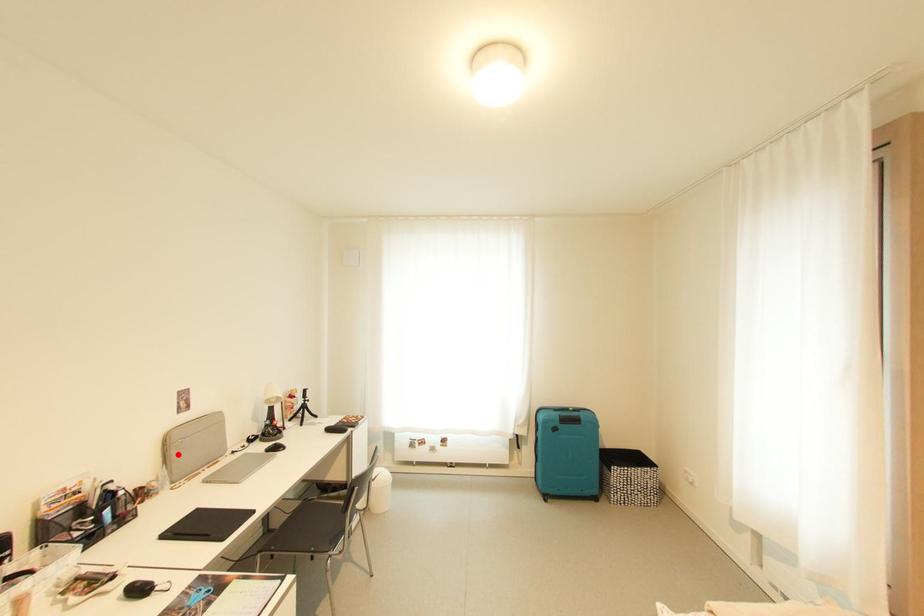
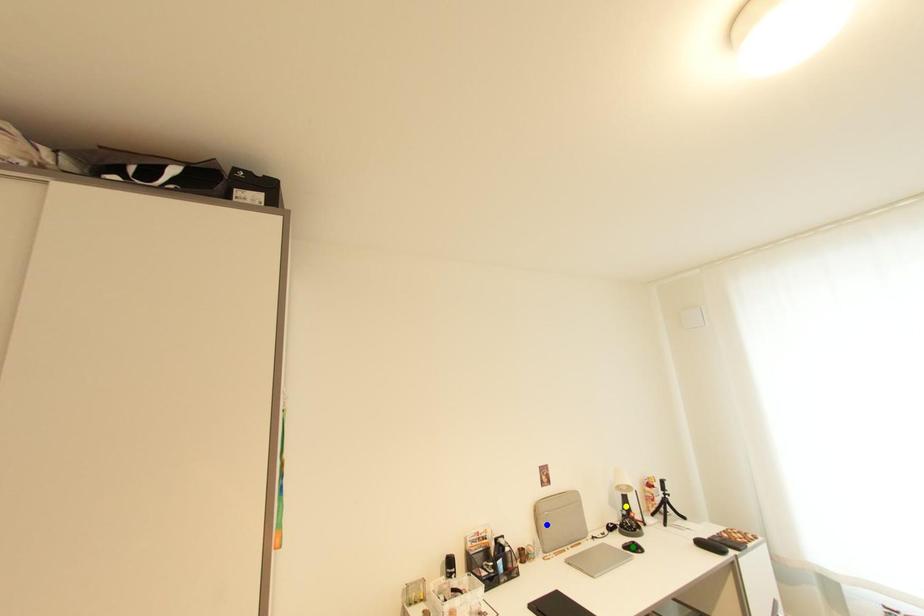
Question: I am providing you with two images of the same scene from different viewpoints. A red point is marked on the first image. You are given multiple points on the second image. Which point in image 2 represents the same 3d spot as the red point in image 1?

Choices:
 (A) yellow point
 (B) green point
 (C) blue point

Answer: (C)